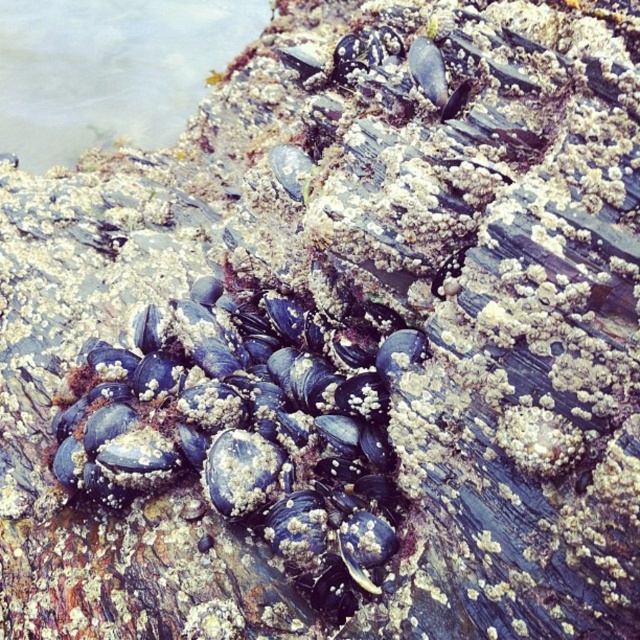
You are a marine biologist examining a tidal pool. You notice the blue matte shells at center and the clear water at upper left. Which object has a smaller thickness?

The blue matte shells at center is thinner than the clear water at upper left, so the blue matte shells at center has a smaller thickness.

You are a marine biologist examining a rock covered in mussels. You notice a specific point marked at coordinates (250, 433). What feature is located at this point?

The point marked at coordinates (250, 433) indicates the location of blue matte shells at center.